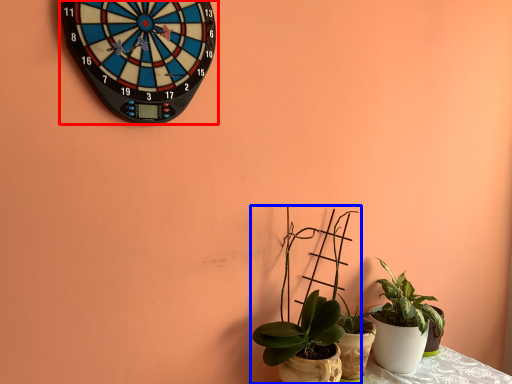
Question: Which object is further to the camera taking this photo, wall clock (highlighted by a red box) or houseplant (highlighted by a blue box)?

Choices:
 (A) wall clock
 (B) houseplant

Answer: (B)